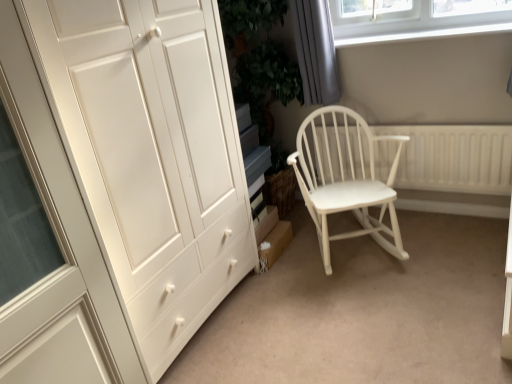
Question: Is matte white wardrobe at left touching white plastic window sill at upper right?

Choices:
 (A) no
 (B) yes

Answer: (A)

Question: Considering the relative sizes of matte white wardrobe at left and white plastic window sill at upper right in the image provided, is matte white wardrobe at left shorter than white plastic window sill at upper right?

Choices:
 (A) no
 (B) yes

Answer: (A)

Question: Is matte white wardrobe at left completely or partially outside of white plastic window sill at upper right?

Choices:
 (A) yes
 (B) no

Answer: (A)

Question: Is matte white wardrobe at left not close to white plastic window sill at upper right?

Choices:
 (A) yes
 (B) no

Answer: (A)

Question: Is matte white wardrobe at left positioned behind white plastic window sill at upper right?

Choices:
 (A) no
 (B) yes

Answer: (A)

Question: Considering the relative sizes of matte white wardrobe at left and white plastic window sill at upper right in the image provided, is matte white wardrobe at left smaller than white plastic window sill at upper right?

Choices:
 (A) yes
 (B) no

Answer: (B)

Question: Considering the relative sizes of matte white wardrobe at left and white wood rocking chair at center in the image provided, is matte white wardrobe at left shorter than white wood rocking chair at center?

Choices:
 (A) yes
 (B) no

Answer: (B)

Question: Is matte white wardrobe at left far from white wood rocking chair at center?

Choices:
 (A) yes
 (B) no

Answer: (B)

Question: Considering the relative positions of matte white wardrobe at left and white wood rocking chair at center in the image provided, is matte white wardrobe at left behind white wood rocking chair at center?

Choices:
 (A) no
 (B) yes

Answer: (A)

Question: From the image's perspective, is matte white wardrobe at left above white wood rocking chair at center?

Choices:
 (A) no
 (B) yes

Answer: (B)

Question: Can you confirm if matte white wardrobe at left is bigger than white wood rocking chair at center?

Choices:
 (A) no
 (B) yes

Answer: (B)

Question: Is matte white wardrobe at left to the left of white wood rocking chair at center from the viewer's perspective?

Choices:
 (A) yes
 (B) no

Answer: (A)

Question: Is gray fabric curtain at upper right to the left of white wood rocking chair at center from the viewer's perspective?

Choices:
 (A) no
 (B) yes

Answer: (B)